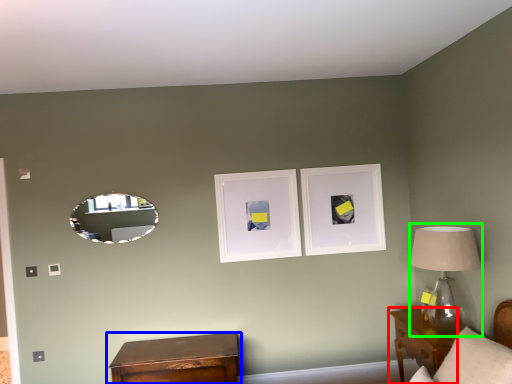
Question: Estimate the real-world distances between objects in this image. Which object is farther from nightstand (highlighted by a red box), nightstand (highlighted by a blue box) or table lamp (highlighted by a green box)?

Choices:
 (A) nightstand
 (B) table lamp

Answer: (A)